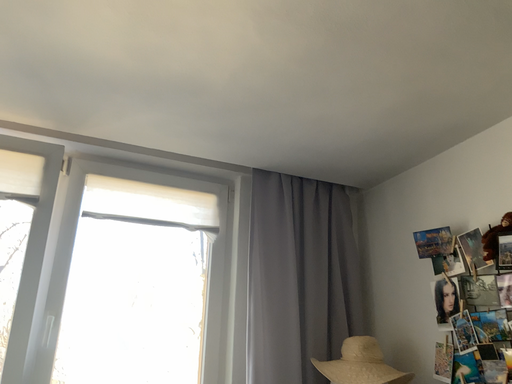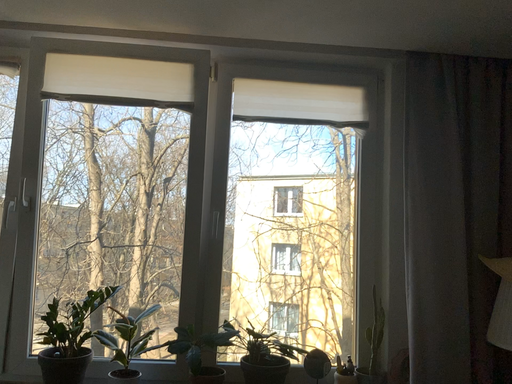
Question: Which way did the camera rotate in the video?

Choices:
 (A) rotated downward
 (B) rotated upward

Answer: (A)